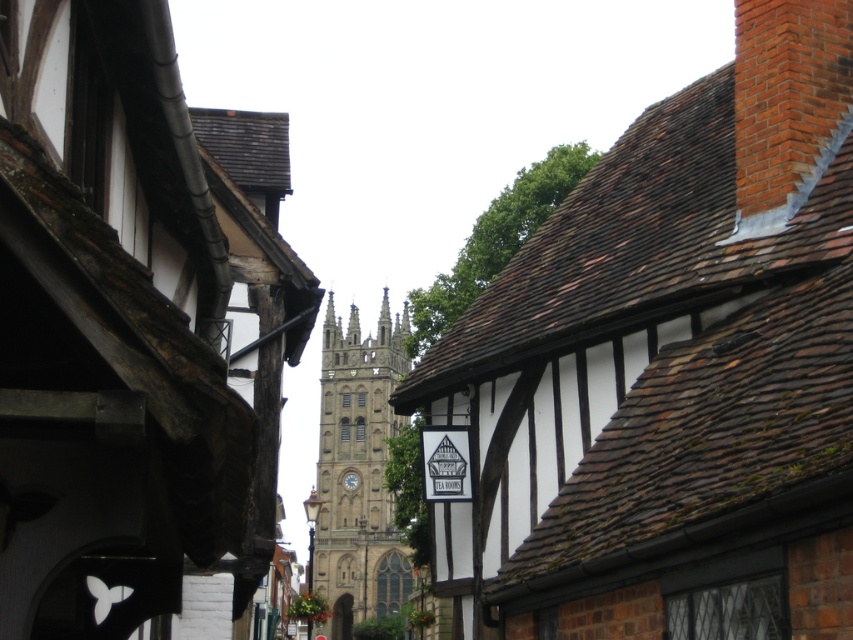
How distant is brown stone tower at center from stone gothic tower at center?

A distance of 103.91 meters exists between brown stone tower at center and stone gothic tower at center.

Describe the element at coordinates (135, 330) in the screenshot. I see `brown stone tower at center` at that location.

Is point (183, 403) farther from viewer compared to point (320, 385)?

No, (183, 403) is in front of (320, 385).

Identify the location of brown stone tower at center. The width and height of the screenshot is (853, 640). (135, 330).

Is brown tiled roof at upper center taller than stone gothic tower at center?

No, brown tiled roof at upper center is not taller than stone gothic tower at center.

Does brown tiled roof at upper center have a lesser width compared to stone gothic tower at center?

No.

Describe the element at coordinates (671, 369) in the screenshot. This screenshot has height=640, width=853. I see `brown tiled roof at upper center` at that location.

Identify the location of brown tiled roof at upper center. [671, 369].

The image size is (853, 640). Describe the element at coordinates (671, 369) in the screenshot. I see `brown tiled roof at upper center` at that location.

Is point (793, 84) farther from camera compared to point (42, 205)?

Yes, it is.

Locate an element on the screen. This screenshot has width=853, height=640. brown tiled roof at upper center is located at coordinates (671, 369).